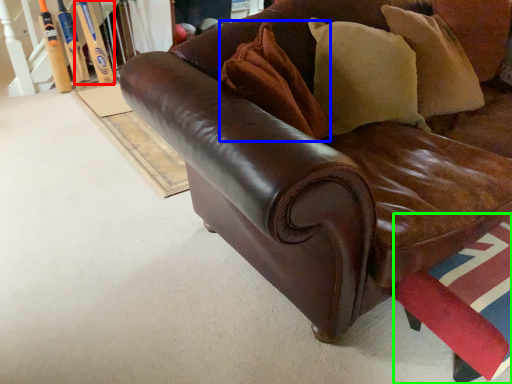
Question: Which object is the closest to the baseball bat (highlighted by a red box)? Choose among these: pillow (highlighted by a blue box) or swivel chair (highlighted by a green box).

Choices:
 (A) pillow
 (B) swivel chair

Answer: (A)